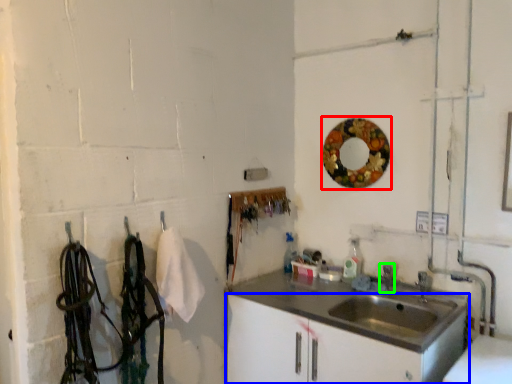
Question: Estimate the real-world distances between objects in this image. Which object is farther from mirror (highlighted by a red box), bathroom cabinet (highlighted by a blue box) or faucet (highlighted by a green box)?

Choices:
 (A) bathroom cabinet
 (B) faucet

Answer: (A)